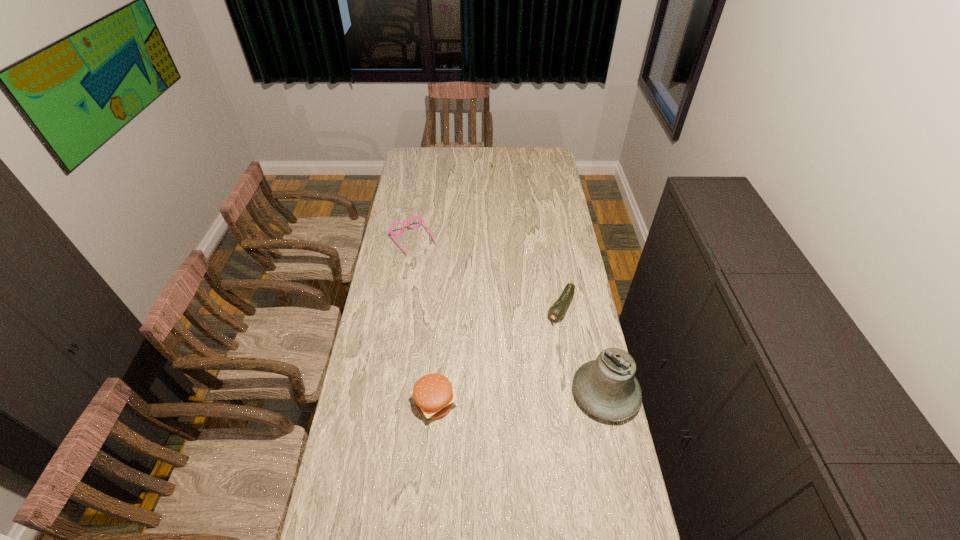
The image size is (960, 540). In order to click on free point between the second tallest object and the spectacles in this screenshot , I will do `click(423, 322)`.

This screenshot has width=960, height=540. I want to click on blank region between the third shortest object and the shortest object, so click(x=497, y=355).

You are a GUI agent. You are given a task and a screenshot of the screen. Output one action in this format:
    pyautogui.click(x=<x>, y=<y>)
    Task: Click on the second closest object to the third nearest object
    This screenshot has width=960, height=540.
    Given the screenshot: What is the action you would take?
    coord(432,393)

You are a GUI agent. You are given a task and a screenshot of the screen. Output one action in this format:
    pyautogui.click(x=<x>, y=<y>)
    Task: Click on the third closest object relative to the spectacles
    The image size is (960, 540).
    Given the screenshot: What is the action you would take?
    pyautogui.click(x=607, y=388)